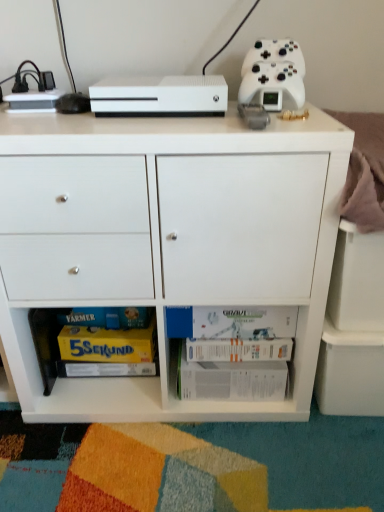
I want to click on free location in front of white matte xbox one s at upper center, so click(152, 125).